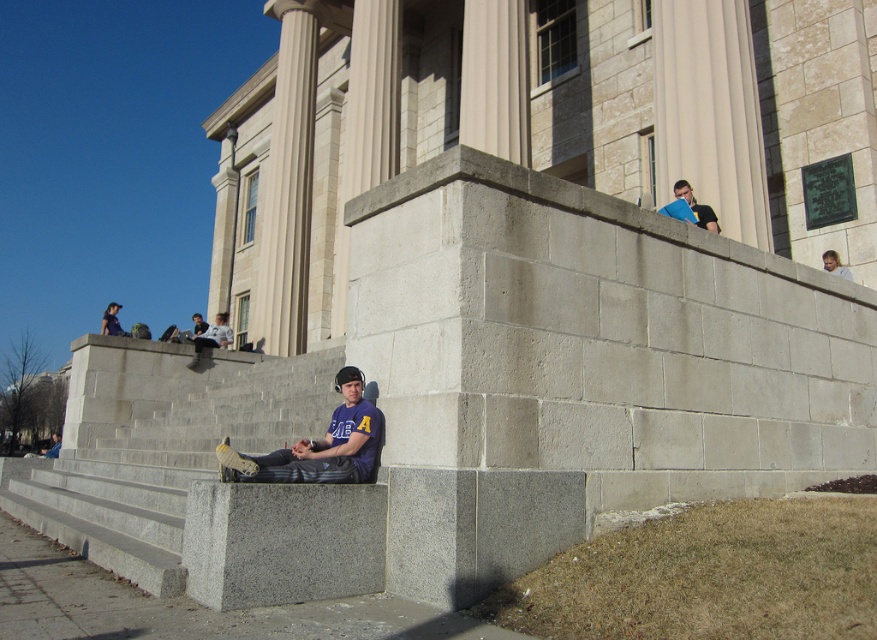
Question: Which object is closer to the camera taking this photo?

Choices:
 (A) light brown hair at upper right
 (B) gray granite concrete at lower center

Answer: (B)

Question: Among these objects, which one is nearest to the camera?

Choices:
 (A) gray granite concrete at lower center
 (B) light brown hair at upper right

Answer: (A)

Question: Which of the following is the closest to the observer?

Choices:
 (A) purple fabric shirt at lower center
 (B) gray granite concrete at lower center
 (C) dark blue shirt at upper left
 (D) light brown hair at upper right

Answer: (B)

Question: Can you confirm if gray granite concrete at lower center is thinner than dark blue shirt at upper left?

Choices:
 (A) yes
 (B) no

Answer: (A)

Question: Does gray granite concrete at lower center appear under dark blue shirt at upper left?

Choices:
 (A) yes
 (B) no

Answer: (A)

Question: From the image, what is the correct spatial relationship of purple fabric shirt at lower center in relation to light brown hair at upper right?

Choices:
 (A) right
 (B) left

Answer: (B)